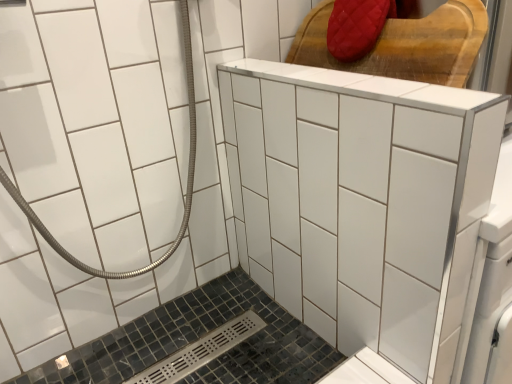
Question: From a real-world perspective, relative to white glossy ceramic tile at center, is red quilted fabric at upper right vertically above or below?

Choices:
 (A) below
 (B) above

Answer: (B)

Question: Is point (436, 66) closer or farther from the camera than point (252, 114)?

Choices:
 (A) closer
 (B) farther

Answer: (A)

Question: Which is nearer to the black mosaic tile bath at lower left?

Choices:
 (A) red quilted fabric at upper right
 (B) white glossy ceramic tile at center

Answer: (B)

Question: Considering the real-world distances, which object is closest to the white glossy ceramic tile at center?

Choices:
 (A) black mosaic tile bath at lower left
 (B) red quilted fabric at upper right

Answer: (B)